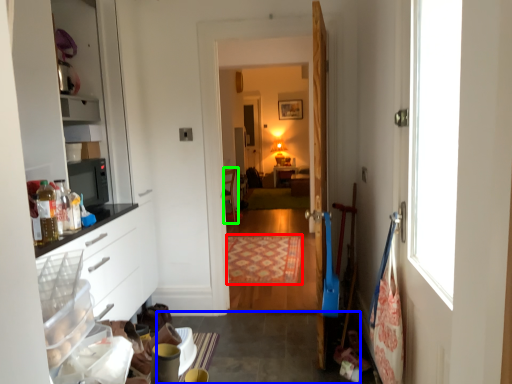
Question: Considering the real-world distances, which object is farthest from mat (highlighted by a red box)? concrete (highlighted by a blue box) or chair (highlighted by a green box)?

Choices:
 (A) concrete
 (B) chair

Answer: (B)